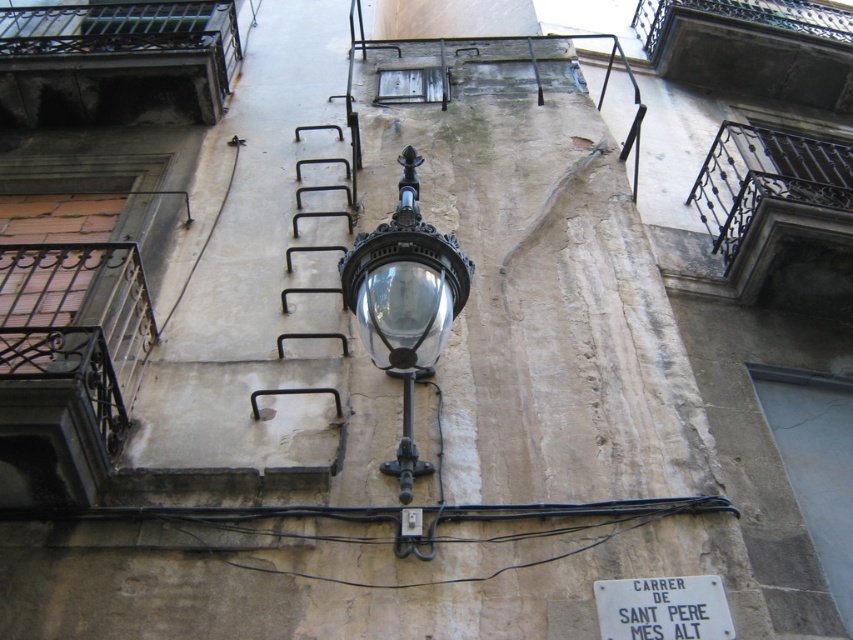
You are standing in front of an old building wall with two points marked on it. The points are labeled as point 1 at coordinates (424, 240) and point 2 at coordinates (683, 588). If you were to walk towards the wall, which point would appear closer to you?

Point 1 at coordinates (424, 240) is closer to the camera than point 2 at coordinates (683, 588), so it would appear closer to you as you walk towards the wall.

You are an architect examining an old building wall. You notice the glossy glass lamp at upper center and the white matte sign at center. Which object is narrower in width?

The glossy glass lamp at upper center has a lesser width compared to the white matte sign at center, so it is narrower.

You are a painter who needs to know the relative heights of the objects to plan your work. Given the scene of an old building wall with a glossy glass lamp at upper center and a white matte sign at center, which object is taller?

The glossy glass lamp at upper center is taller than the white matte sign at center according to the description.